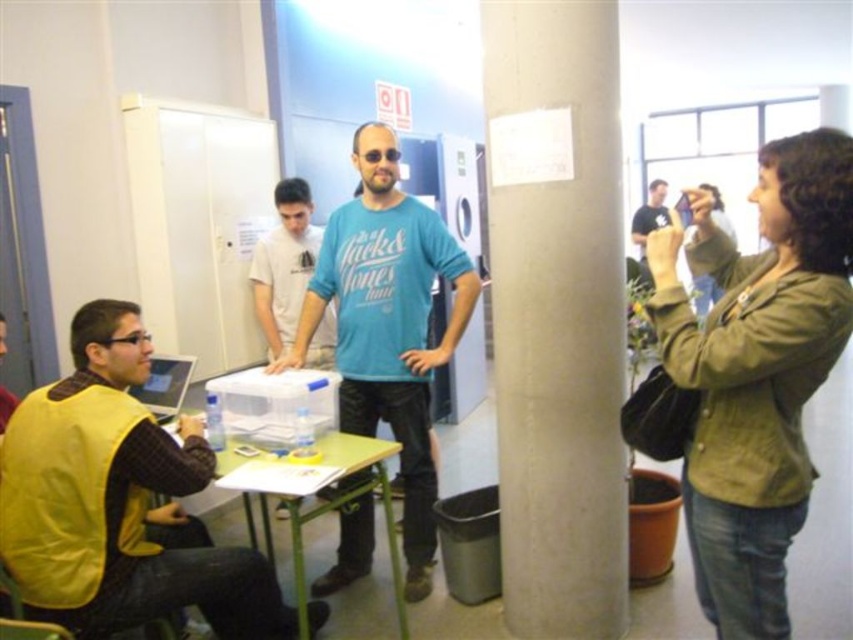
Question: Among these objects, which one is farthest from the camera?

Choices:
 (A) concrete pillar at center
 (B) dark blue t-shirt at upper right
 (C) matte black laptop at left

Answer: (B)

Question: Among these objects, which one is farthest from the camera?

Choices:
 (A) white plastic container at center
 (B) concrete pillar at center
 (C) blue cotton shirt at center

Answer: (A)

Question: Can you confirm if yellow fabric vest at lower left is positioned below blue cotton shirt at center?

Choices:
 (A) no
 (B) yes

Answer: (B)

Question: Does green matte jacket at right have a smaller size compared to matte black laptop at left?

Choices:
 (A) no
 (B) yes

Answer: (A)

Question: Where is blue cotton shirt at center located in relation to white plastic container at center in the image?

Choices:
 (A) right
 (B) left

Answer: (A)

Question: Which point is closer to the camera?

Choices:
 (A) dark blue t-shirt at upper right
 (B) green plastic table at lower center
 (C) yellow fabric vest at lower left

Answer: (C)